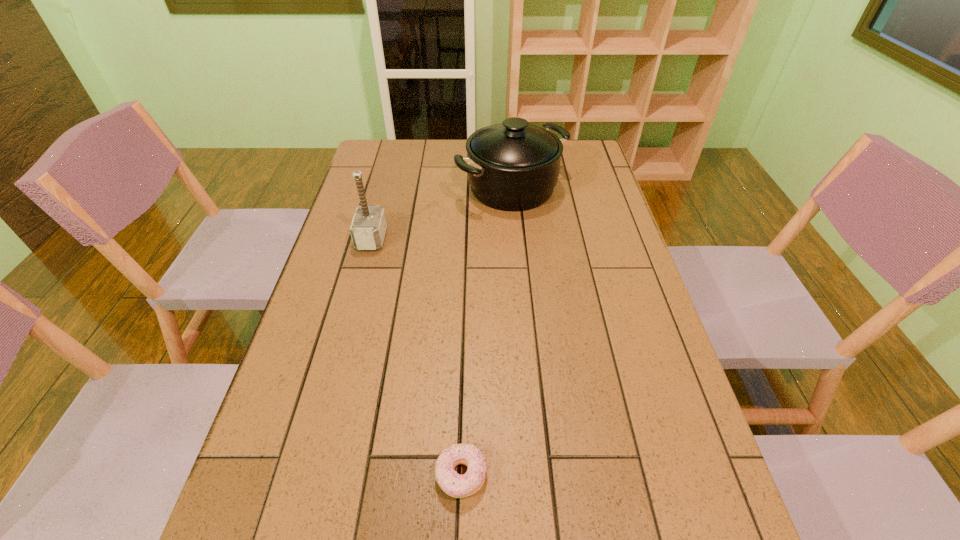
I want to click on free point that satisfies the following two spatial constraints: 1. for striking with the head of the shortest object; 2. on the right side of the second nearest object, so click(308, 475).

Identify the location of vacant region that satisfies the following two spatial constraints: 1. for striking with the head of the hammer; 2. on the left side of the doughnut. (308, 475).

This screenshot has width=960, height=540. Identify the location of vacant area that satisfies the following two spatial constraints: 1. on the front side of the farthest object; 2. for striking with the head of the leftmost object. (516, 239).